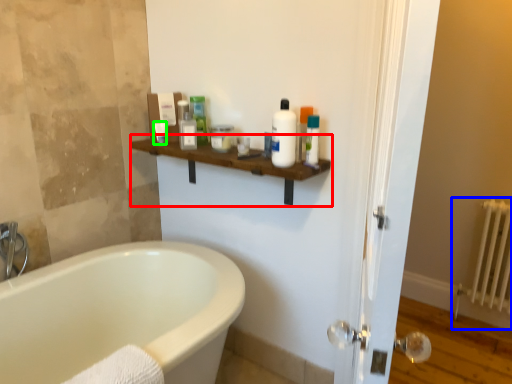
Question: Which object is the farthest from balustrade (highlighted by a red box)? Choose among these: radiator (highlighted by a blue box) or toiletry (highlighted by a green box).

Choices:
 (A) radiator
 (B) toiletry

Answer: (A)